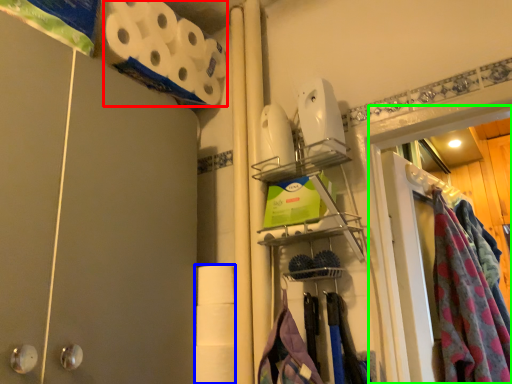
Question: Based on their relative distances, which object is farther from toilet paper (highlighted by a red box)? Choose from toilet paper (highlighted by a blue box) and glass door (highlighted by a green box).

Choices:
 (A) toilet paper
 (B) glass door

Answer: (B)